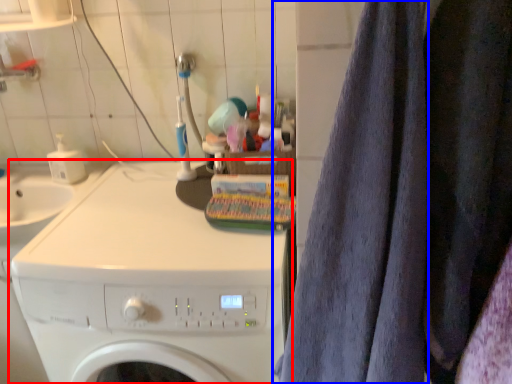
Question: Which object appears farthest to the camera in this image, washing machine (highlighted by a red box) or bath towel (highlighted by a blue box)?

Choices:
 (A) washing machine
 (B) bath towel

Answer: (A)